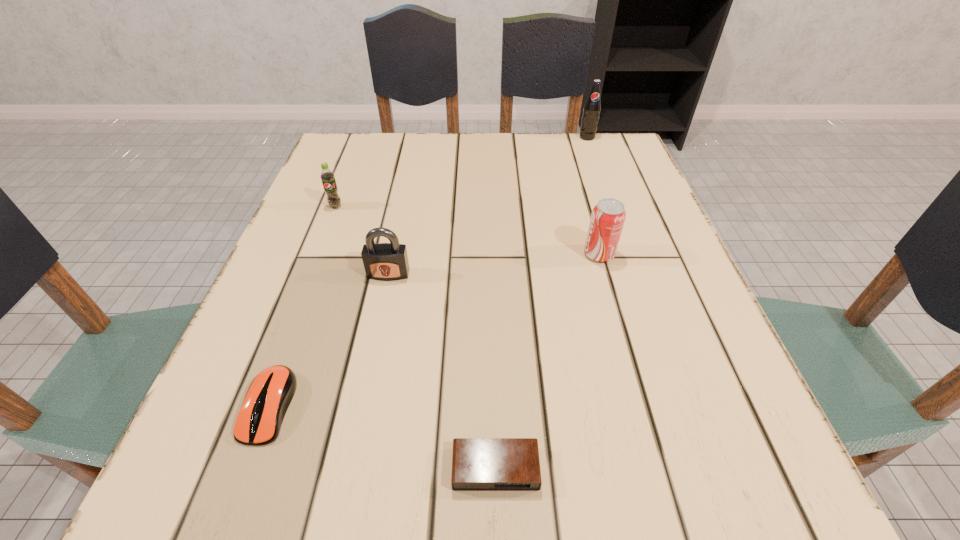
This screenshot has height=540, width=960. I want to click on the farthest object, so click(592, 107).

You are a GUI agent. You are given a task and a screenshot of the screen. Output one action in this format:
    pyautogui.click(x=<x>, y=<y>)
    Task: Click on the rightmost object
    The height and width of the screenshot is (540, 960).
    Given the screenshot: What is the action you would take?
    pyautogui.click(x=592, y=107)

The image size is (960, 540). I want to click on the fourth nearest object, so click(608, 216).

Find the location of a particular element. the second object from right to left is located at coordinates (608, 216).

Find the location of a particular element. The image size is (960, 540). the third object from left to right is located at coordinates (382, 261).

Locate an element on the screen. The width and height of the screenshot is (960, 540). the third nearest object is located at coordinates (382, 261).

Locate an element on the screen. The width and height of the screenshot is (960, 540). the leftmost soda is located at coordinates (327, 176).

You are a GUI agent. You are given a task and a screenshot of the screen. Output one action in this format:
    pyautogui.click(x=<x>, y=<y>)
    Task: Click on the second nearest soda
    
    Given the screenshot: What is the action you would take?
    pyautogui.click(x=327, y=176)

This screenshot has width=960, height=540. I want to click on the fifth farthest object, so click(x=269, y=395).

Where is `the shortest object`? The height and width of the screenshot is (540, 960). the shortest object is located at coordinates (478, 464).